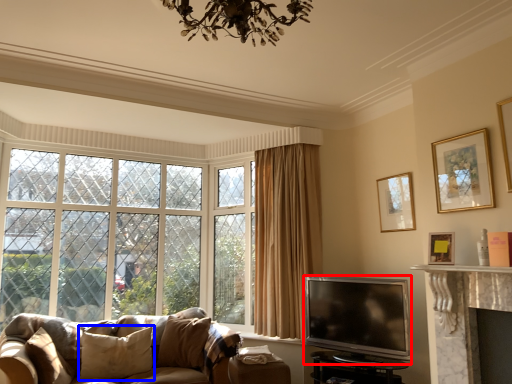
Question: Which of the following is the closest to the observer, television (highlighted by a red box) or pillow (highlighted by a blue box)?

Choices:
 (A) television
 (B) pillow

Answer: (A)